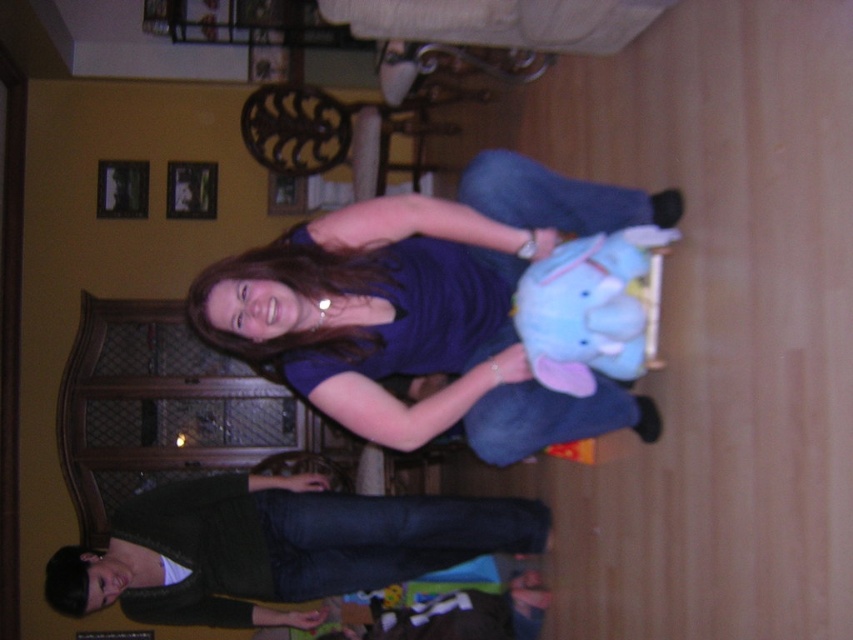
Question: Considering the relative positions of matte blue dress at center and dark blue jeans at lower center in the image provided, where is matte blue dress at center located with respect to dark blue jeans at lower center?

Choices:
 (A) below
 (B) above

Answer: (B)

Question: Is dark blue jeans at lower center to the right of soft blue plush elephant at center from the viewer's perspective?

Choices:
 (A) no
 (B) yes

Answer: (A)

Question: Which object is closer to the camera taking this photo?

Choices:
 (A) soft blue plush elephant at center
 (B) dark blue jeans at lower center
 (C) matte blue dress at center

Answer: (A)

Question: Observing the image, what is the correct spatial positioning of matte blue dress at center in reference to dark blue jeans at lower center?

Choices:
 (A) above
 (B) below

Answer: (A)

Question: Which of these objects is positioned closest to the matte blue dress at center?

Choices:
 (A) soft blue plush elephant at center
 (B) dark blue jeans at lower center

Answer: (A)

Question: Which point is closer to the camera taking this photo?

Choices:
 (A) (576, 371)
 (B) (195, 611)

Answer: (A)